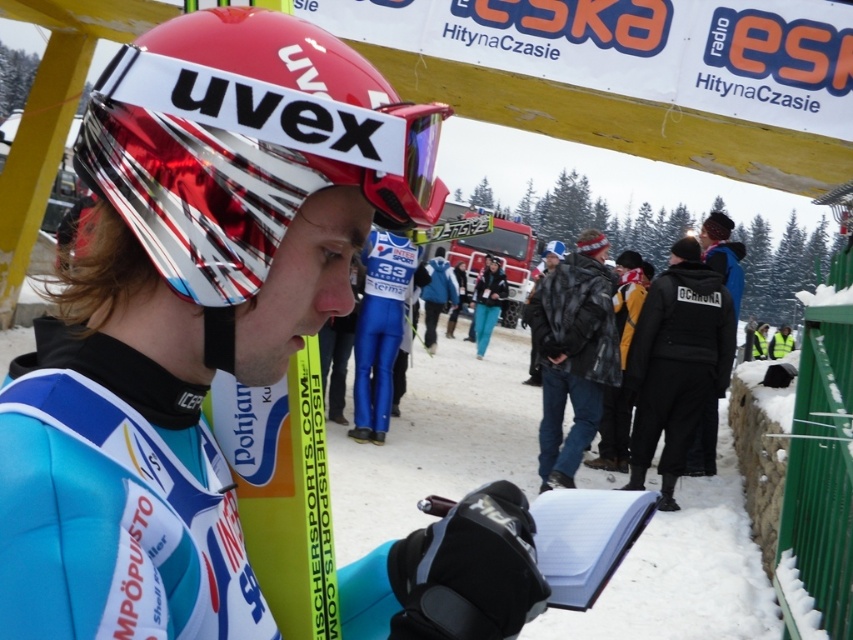
Question: Which of the following is the farthest from the observer?

Choices:
 (A) (494, 288)
 (B) (271, 208)
 (C) (614, 380)

Answer: (A)

Question: Does leather jacket at center have a greater width compared to transparent plastic goggles at center?

Choices:
 (A) yes
 (B) no

Answer: (A)

Question: Based on their relative distances, which object is nearer to the leather jacket at center?

Choices:
 (A) matte blue snowsuit at center
 (B) teal fabric pants at center

Answer: (A)

Question: Which point appears farthest from the camera in this image?

Choices:
 (A) (567, 314)
 (B) (120, 547)

Answer: (A)

Question: Is leather jacket at center bigger than teal fabric pants at center?

Choices:
 (A) no
 (B) yes

Answer: (A)

Question: Where is leather jacket at center located in relation to transparent plastic goggles at center in the image?

Choices:
 (A) right
 (B) left

Answer: (A)